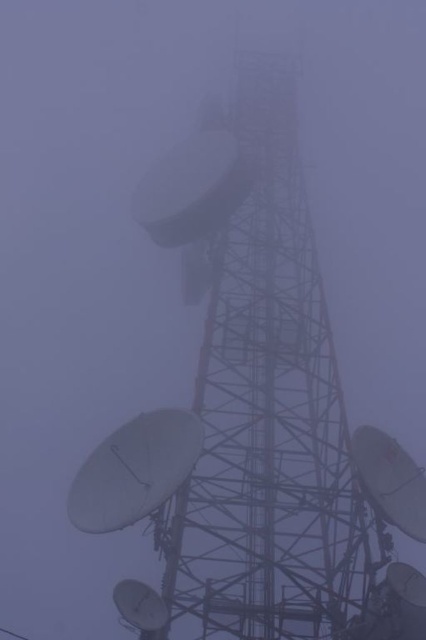
Who is more forward, (351, 566) or (138, 474)?

Point (138, 474)

Does metallic gray satellite dish at center have a greater height compared to white matte satellite at center?

Yes.

The height and width of the screenshot is (640, 426). What do you see at coordinates (258, 388) in the screenshot? I see `metallic gray satellite dish at center` at bounding box center [258, 388].

Image resolution: width=426 pixels, height=640 pixels. What are the coordinates of `metallic gray satellite dish at center` in the screenshot? It's located at (258, 388).